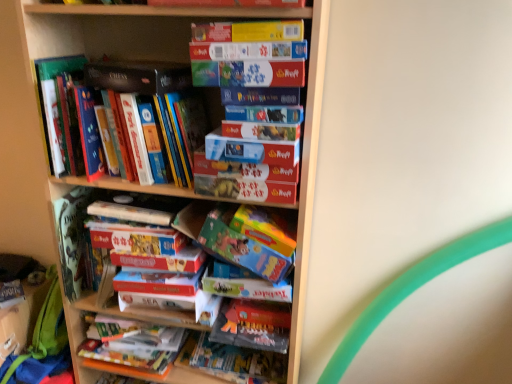
From the picture: Measure the distance between point (247, 306) and camera.

Point (247, 306) and camera are 1.35 meters apart.

Identify the location of hardcover book at upper left, the 1th book from the top. (132, 89).

Describe the element at coordinates (42, 344) in the screenshot. I see `green fabric backpack at lower left` at that location.

Locate an element on the screen. blue cardboard book at center, which ranks as the second paperback book in bottom-to-top order is located at coordinates (244, 170).

The height and width of the screenshot is (384, 512). Describe the element at coordinates (244, 170) in the screenshot. I see `blue cardboard book at center, placed as the 7th paperback book when sorted from top to bottom` at that location.

The width and height of the screenshot is (512, 384). What do you see at coordinates (248, 31) in the screenshot?
I see `yellow cardboard book at upper center, the first paperback book from the top` at bounding box center [248, 31].

The image size is (512, 384). What do you see at coordinates (251, 150) in the screenshot? I see `matte cardboard book at center, the sixth paperback book from the top` at bounding box center [251, 150].

Describe the element at coordinates (248, 73) in the screenshot. I see `matte cardboard book at center, which ranks as the fourth paperback book in top-to-bottom order` at that location.

You are a GUI agent. You are given a task and a screenshot of the screen. Output one action in this format:
    pyautogui.click(x=<x>, y=<y>)
    Task: Click on the hardcover book at center, which is the 1th paperback book from bottom to top
    This screenshot has height=384, width=512.
    Given the screenshot: What is the action you would take?
    pyautogui.click(x=252, y=325)

Does point (37, 343) lie in front of point (324, 36)?

That is False.

Is green fabric backpack at lower left beside wooden bookcase at center?

No.

How different are the orientations of green fabric backpack at lower left and wooden bookcase at center in degrees?

The facing directions of green fabric backpack at lower left and wooden bookcase at center are 1.14 degrees apart.

Is green fabric backpack at lower left taller than wooden bookcase at center?

Incorrect, the height of green fabric backpack at lower left is not larger of that of wooden bookcase at center.

What's the angular difference between matte cardboard book at center, the 3th paperback book when ordered from bottom to top, and matte black book at upper left, the third paperback book in the top-to-bottom sequence,'s facing directions?

The angular difference between matte cardboard book at center, the 3th paperback book when ordered from bottom to top, and matte black book at upper left, the third paperback book in the top-to-bottom sequence, is 1.22 degrees.

Looking at this image, is matte cardboard book at center, the sixth paperback book from the top, facing towards matte black book at upper left, the third paperback book in the top-to-bottom sequence?

No, matte cardboard book at center, the sixth paperback book from the top, does not turn towards matte black book at upper left, the third paperback book in the top-to-bottom sequence.

Are matte cardboard book at center, the sixth paperback book from the top, and matte black book at upper left, the third paperback book in the top-to-bottom sequence, located far from each other?

That's not correct — matte cardboard book at center, the sixth paperback book from the top, is a little close to matte black book at upper left, the third paperback book in the top-to-bottom sequence.

From the image's perspective, is matte cardboard book at center, the sixth paperback book from the top, under matte black book at upper left, which is counted as the sixth paperback book, starting from the bottom?

Yes.

Is matte black book at upper left, the third paperback book in the top-to-bottom sequence, behind green fabric backpack at lower left?

No, matte black book at upper left, the third paperback book in the top-to-bottom sequence, is in front of green fabric backpack at lower left.

Who is taller, matte black book at upper left, which is counted as the sixth paperback book, starting from the bottom, or green fabric backpack at lower left?

green fabric backpack at lower left is taller.

Would you say matte black book at upper left, the third paperback book in the top-to-bottom sequence, is inside or outside green fabric backpack at lower left?

matte black book at upper left, the third paperback book in the top-to-bottom sequence, lies outside green fabric backpack at lower left.

Is matte cardboard book at center, the sixth paperback book from the top, touching hardcover book at upper left, the 2th book positioned from the bottom?

matte cardboard book at center, the sixth paperback book from the top, and hardcover book at upper left, the 2th book positioned from the bottom, are not in contact.

From a real-world perspective, which is physically above, matte cardboard book at center, the sixth paperback book from the top, or hardcover book at upper left, the 1th book from the top?

In real-world perspective, hardcover book at upper left, the 1th book from the top, is above.

Which object is further away from the camera, matte cardboard book at center, the 3th paperback book when ordered from bottom to top, or hardcover book at upper left, the 1th book from the top?

hardcover book at upper left, the 1th book from the top, is more distant.

Is matte cardboard book at center, the 3th paperback book when ordered from bottom to top, situated inside hardcover book at upper left, the 2th book positioned from the bottom, or outside?

matte cardboard book at center, the 3th paperback book when ordered from bottom to top, is spatially situated outside hardcover book at upper left, the 2th book positioned from the bottom.

From the image's perspective, is wooden bookcase at center on hardcover book at center, which is the 1th paperback book from bottom to top?

Yes, from the image's perspective, wooden bookcase at center is on top of hardcover book at center, which is the 1th paperback book from bottom to top.

From a real-world perspective, who is located lower, wooden bookcase at center or hardcover book at center, which is counted as the 8th paperback book, starting from the top?

hardcover book at center, which is counted as the 8th paperback book, starting from the top.

Does wooden bookcase at center come in front of hardcover book at center, which is the 1th paperback book from bottom to top?

Yes.

Is wooden bookcase at center touching hardcover book at center, which is counted as the 8th paperback book, starting from the top?

No, wooden bookcase at center is not beside hardcover book at center, which is counted as the 8th paperback book, starting from the top.

Does matte cardboard book at center, which is the fifth paperback book in bottom-to-top order, come behind green fabric backpack at lower left?

No, matte cardboard book at center, which is the fifth paperback book in bottom-to-top order, is in front of green fabric backpack at lower left.

From the image's perspective, which one is positioned higher, matte cardboard book at center, which ranks as the fourth paperback book in top-to-bottom order, or green fabric backpack at lower left?

matte cardboard book at center, which ranks as the fourth paperback book in top-to-bottom order, appears higher in the image.

Which is in front, point (225, 71) or point (47, 337)?

Point (225, 71)

Is matte cardboard book at center, acting as the fourth paperback book starting from the bottom, behind blue cardboard book at center, placed as the 7th paperback book when sorted from top to bottom?

No.

From a real-world perspective, is matte cardboard book at center, acting as the fourth paperback book starting from the bottom, positioned over blue cardboard book at center, placed as the 7th paperback book when sorted from top to bottom, based on gravity?

Yes, from a real-world perspective, matte cardboard book at center, acting as the fourth paperback book starting from the bottom, is above blue cardboard book at center, placed as the 7th paperback book when sorted from top to bottom.

Is matte cardboard book at center, the fifth paperback book when ordered from top to bottom, with blue cardboard book at center, which ranks as the second paperback book in bottom-to-top order?

matte cardboard book at center, the fifth paperback book when ordered from top to bottom, is not next to blue cardboard book at center, which ranks as the second paperback book in bottom-to-top order, and they're not touching.

Based on the photo, could blue cardboard book at center, which ranks as the second paperback book in bottom-to-top order, be considered to be inside matte cardboard book at center, the fifth paperback book when ordered from top to bottom?

That's incorrect, blue cardboard book at center, which ranks as the second paperback book in bottom-to-top order, is not inside matte cardboard book at center, the fifth paperback book when ordered from top to bottom.

You are a GUI agent. You are given a task and a screenshot of the screen. Output one action in this format:
    pyautogui.click(x=<x>, y=<y>)
    Task: Click on the bookcase that is above the green fabric backpack at lower left (from a real-world perspective)
    
    Given the screenshot: What is the action you would take?
    pyautogui.click(x=182, y=61)

From the matte black book at upper left, which is counted as the sixth paperback book, starting from the bottom, count 2nd paperback books forward and point to it. Please provide its 2D coordinates.

[(251, 150)]

In the scene shown: Looking at the image, which one is located further to matte cardboard book at upper center, which appears as the 7th paperback book when ordered from the bottom, hardcover book at center, which is counted as the 8th paperback book, starting from the top, or blue cardboard book at center, which ranks as the second paperback book in bottom-to-top order?

hardcover book at center, which is counted as the 8th paperback book, starting from the top, is further to matte cardboard book at upper center, which appears as the 7th paperback book when ordered from the bottom.

In the scene shown: Looking at the image, which one is located closer to green fabric backpack at lower left, matte black book at upper left, which is counted as the sixth paperback book, starting from the bottom, or matte cardboard book at upper center, the second paperback book from the top?

The object closer to green fabric backpack at lower left is matte black book at upper left, which is counted as the sixth paperback book, starting from the bottom.

Estimate the real-world distances between objects in this image. Which object is further from hardcover book at center, which is the 1th paperback book from bottom to top, matte cardboard book at upper center, the second paperback book from the top, or green fabric backpack at lower left?

matte cardboard book at upper center, the second paperback book from the top, is positioned further to the anchor hardcover book at center, which is the 1th paperback book from bottom to top.

Estimate the real-world distances between objects in this image. Which object is further from hardcover book at upper left, the 1th book from the top, matte black book at upper left, which is counted as the sixth paperback book, starting from the bottom, or matte cardboard book at upper center, the second paperback book from the top?

matte cardboard book at upper center, the second paperback book from the top.

Looking at this image, based on their spatial positions, is matte cardboard book at upper center, which appears as the 7th paperback book when ordered from the bottom, or hardcover book at upper left, the 2th book positioned from the bottom, further from matte cardboard book at center, which is the first book in bottom-to-top order?

Among the two, matte cardboard book at upper center, which appears as the 7th paperback book when ordered from the bottom, is located further to matte cardboard book at center, which is the first book in bottom-to-top order.

From the image, which object appears to be nearer to green fabric backpack at lower left, matte cardboard book at center, the sixth paperback book from the top, or blue cardboard book at center, placed as the 7th paperback book when sorted from top to bottom?

Based on the image, blue cardboard book at center, placed as the 7th paperback book when sorted from top to bottom, appears to be nearer to green fabric backpack at lower left.

Estimate the real-world distances between objects in this image. Which object is closer to hardcover book at center, which is counted as the 8th paperback book, starting from the top, matte cardboard book at center, which is the fifth paperback book in bottom-to-top order, or yellow cardboard book at upper center, the eighth paperback book positioned from the bottom?

matte cardboard book at center, which is the fifth paperback book in bottom-to-top order.

When comparing their distances from hardcover book at center, which is the 1th paperback book from bottom to top, does wooden bookcase at center or matte cardboard book at center, acting as the fourth paperback book starting from the bottom, seem closer?

Among the two, wooden bookcase at center is located nearer to hardcover book at center, which is the 1th paperback book from bottom to top.

Where is `bookcase between matte cardboard book at upper center, which appears as the 7th paperback book when ordered from the bottom, and green fabric backpack at lower left vertically`? This screenshot has width=512, height=384. bookcase between matte cardboard book at upper center, which appears as the 7th paperback book when ordered from the bottom, and green fabric backpack at lower left vertically is located at coordinates (182, 61).

Locate an element on the screen. paperback book located between hardcover book at upper left, the 1th book from the top, and blue cardboard book at center, placed as the 7th paperback book when sorted from top to bottom, in the left-right direction is located at coordinates (138, 76).

The image size is (512, 384). Identify the location of book that lies between yellow cardboard book at upper center, the eighth paperback book positioned from the bottom, and wooden bookcase at center from top to bottom. (132, 89).

The width and height of the screenshot is (512, 384). In order to click on bookcase between matte cardboard book at center, which is the fifth paperback book in bottom-to-top order, and hardcover book at center, which is counted as the 8th paperback book, starting from the top, vertically in this screenshot , I will do `click(182, 61)`.